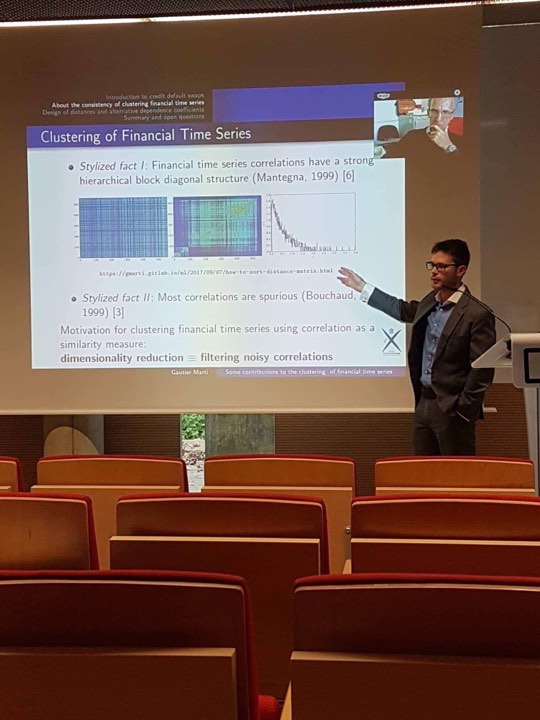
At what (x,y) coordinates should I click in order to perform the action: click on wall. Please return your answer as a coordinate pair (x, y). The image size is (540, 720). Looking at the image, I should click on (335, 428).